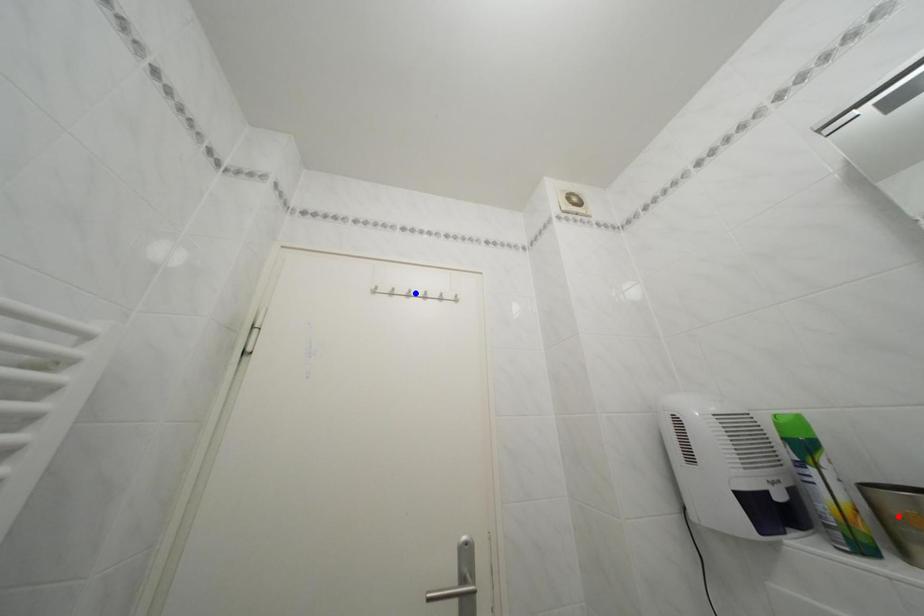
Question: In the image, two points are highlighted. Which point is nearer to the camera? Reply with the corresponding letter.

Choices:
 (A) blue point
 (B) red point

Answer: (B)